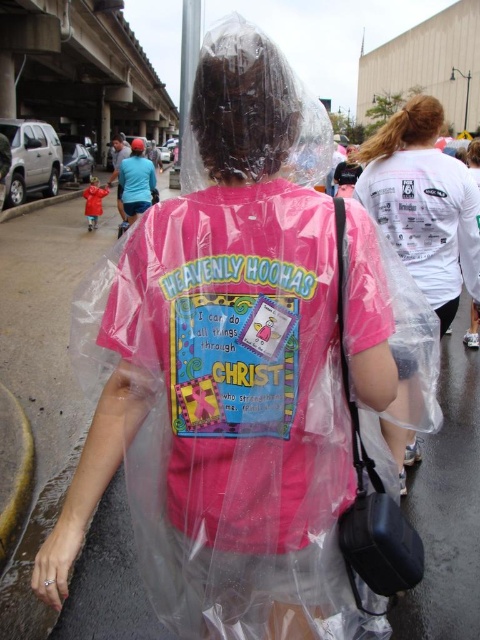
Describe the element at coordinates (423, 204) in the screenshot. The image size is (480, 640). I see `transparent plastic bag at right` at that location.

Is transparent plastic bag at right wider than black synthetic bag at right?

Correct, the width of transparent plastic bag at right exceeds that of black synthetic bag at right.

At what (x,y) coordinates should I click in order to perform the action: click on transparent plastic bag at right. Please return your answer as a coordinate pair (x, y). Image resolution: width=480 pixels, height=640 pixels. Looking at the image, I should click on (423, 204).